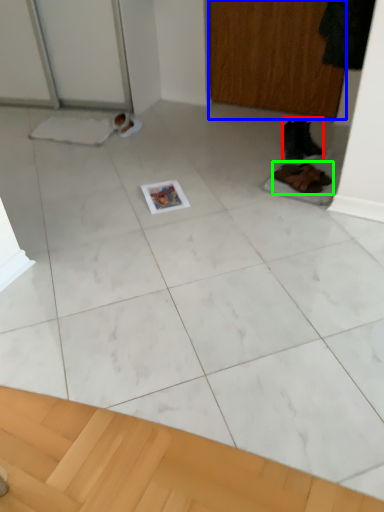
Question: Which object is positioned farthest from footwear (highlighted by a red box)? Select from screen door (highlighted by a blue box) and footwear (highlighted by a green box).

Choices:
 (A) screen door
 (B) footwear

Answer: (A)